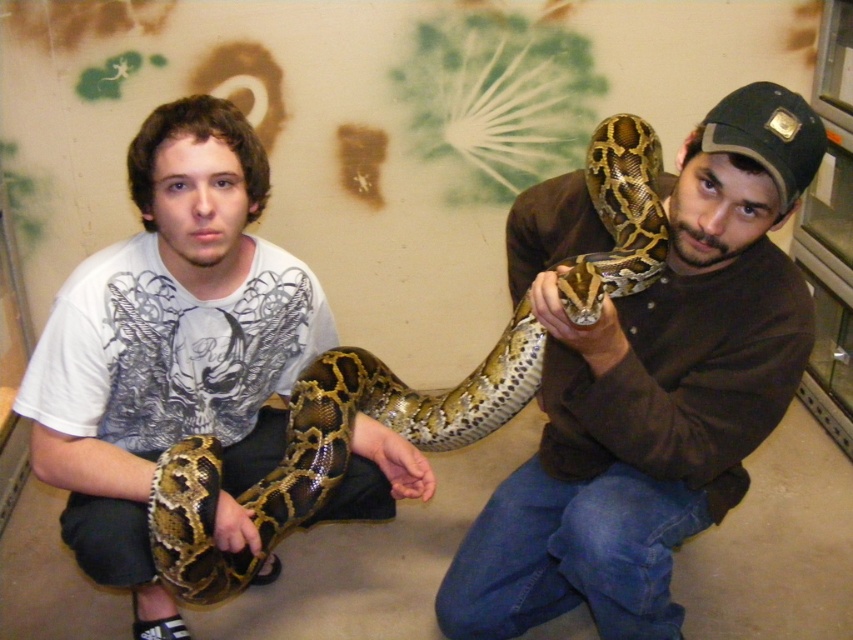
Question: Can you confirm if white printed t-shirt at center is positioned to the left of shiny brown snake at center?

Choices:
 (A) yes
 (B) no

Answer: (A)

Question: Which of these objects is positioned farthest from the brown leather jacket at center?

Choices:
 (A) shiny brown snake at center
 (B) white printed t-shirt at center

Answer: (B)

Question: Which point appears closest to the camera in this image?

Choices:
 (A) [416, 438]
 (B) [170, 104]

Answer: (B)

Question: Does white printed t-shirt at center have a larger size compared to shiny brown snake at center?

Choices:
 (A) no
 (B) yes

Answer: (B)

Question: Which point is closer to the camera taking this photo?

Choices:
 (A) (666, 259)
 (B) (190, 561)

Answer: (B)

Question: Does white printed t-shirt at center appear over shiny brown snake at center?

Choices:
 (A) no
 (B) yes

Answer: (B)